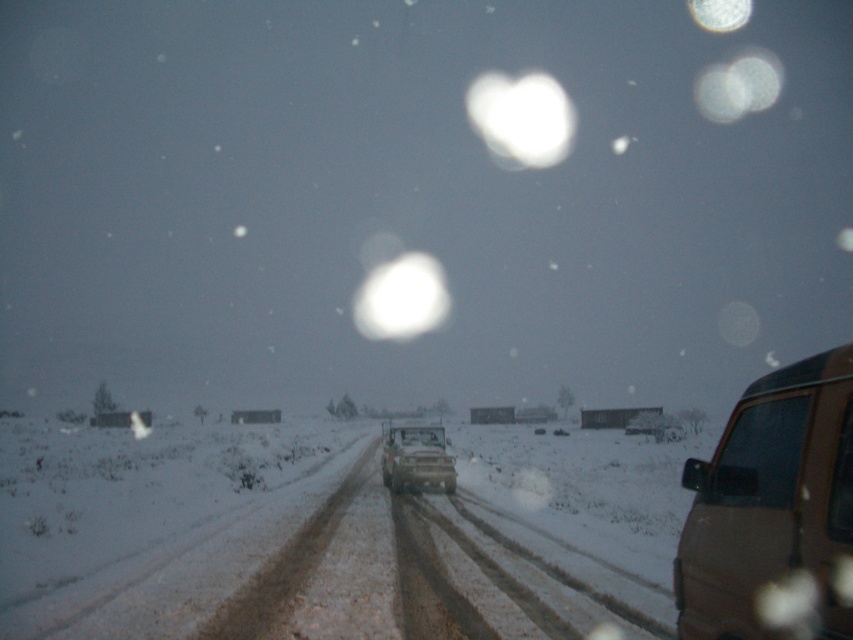
Looking at this image, does snowy dirt road at center have a greater height compared to brown matte van at right?

No, snowy dirt road at center is not taller than brown matte van at right.

Is point (265, 536) behind point (732, 440)?

Yes, point (265, 536) is behind point (732, 440).

At what (x,y) coordinates should I click in order to perform the action: click on snowy dirt road at center. Please return your answer as a coordinate pair (x, y). This screenshot has width=853, height=640. Looking at the image, I should click on (326, 536).

Does brown matte van at right have a lesser width compared to metallic silver truck at center?

No, brown matte van at right is not thinner than metallic silver truck at center.

Who is more distant from viewer, (746, 403) or (437, 468)?

→ Positioned behind is point (437, 468).

Which is in front, point (718, 452) or point (432, 429)?

Point (718, 452) is more forward.

You are a GUI agent. You are given a task and a screenshot of the screen. Output one action in this format:
    pyautogui.click(x=<x>, y=<y>)
    Task: Click on the brown matte van at right
    This screenshot has width=853, height=640.
    Given the screenshot: What is the action you would take?
    pyautogui.click(x=770, y=500)

Between point (38, 540) and point (407, 472), which one is positioned in front?

Positioned in front is point (38, 540).

Is point (70, 593) in front of point (381, 474)?

Yes, point (70, 593) is in front of point (381, 474).

The width and height of the screenshot is (853, 640). I want to click on snowy dirt road at center, so [x=326, y=536].